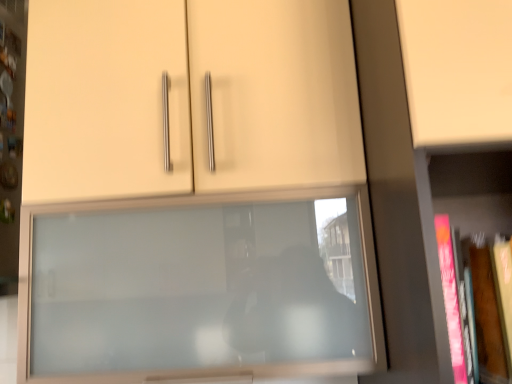
Question: In the image, is pink matte book at right positioned in front of or behind hardcover book at right?

Choices:
 (A) front
 (B) behind

Answer: (A)

Question: Do you think pink matte book at right is within hardcover book at right, or outside of it?

Choices:
 (A) inside
 (B) outside

Answer: (B)

Question: Which object is positioned closest to the hardcover book at right?

Choices:
 (A) pink matte book at right
 (B) matte glass cupboard at center

Answer: (A)

Question: Estimate the real-world distances between objects in this image. Which object is closer to the matte glass cupboard at center?

Choices:
 (A) hardcover book at right
 (B) pink matte book at right

Answer: (B)